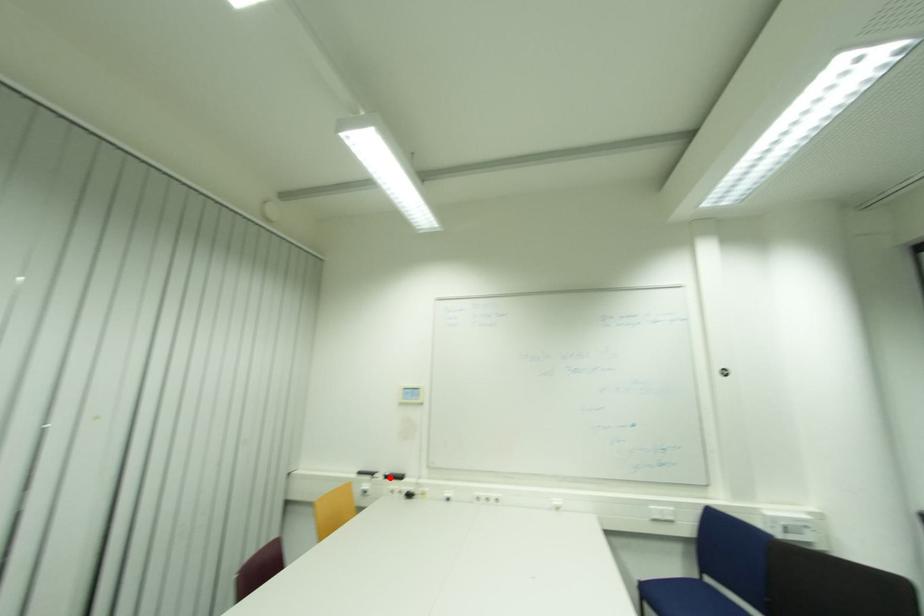
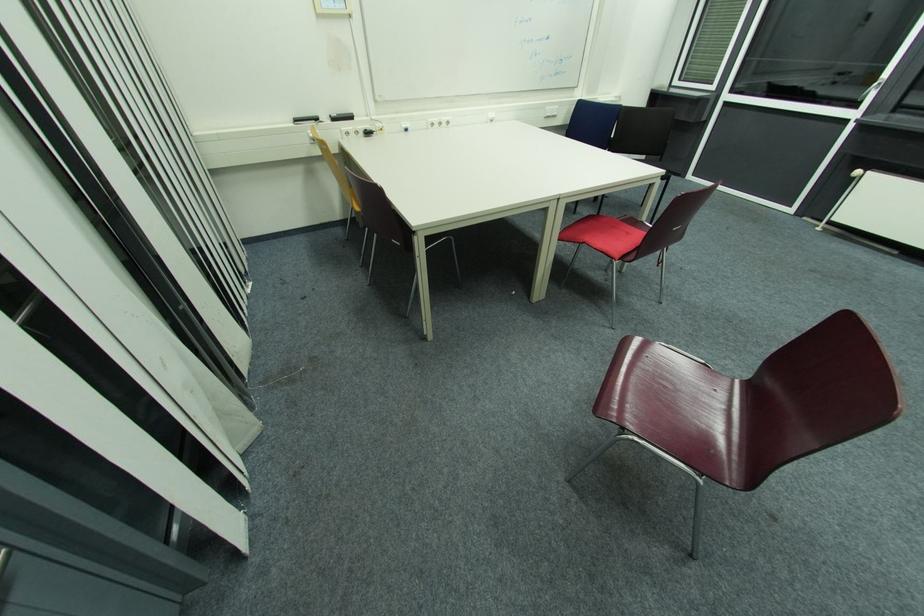
Question: A red point is marked in image1. In image2, is the corresponding 3D point closer to the camera or farther? Reply with the corresponding letter.

Choices:
 (A) The corresponding 3D point is closer.
 (B) The corresponding 3D point is farther.

Answer: (A)